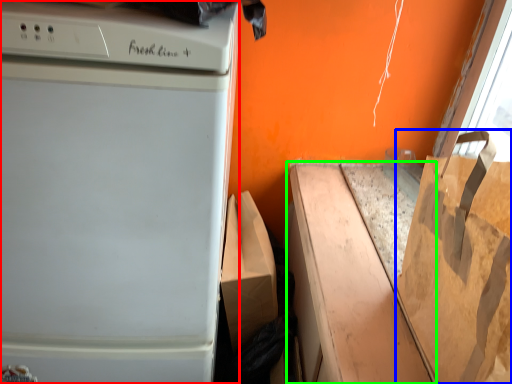
Question: Considering the real-world distances, which object is farthest from home appliance (highlighted by a red box)? grocery bag (highlighted by a blue box) or cardboard box (highlighted by a green box)?

Choices:
 (A) grocery bag
 (B) cardboard box

Answer: (A)